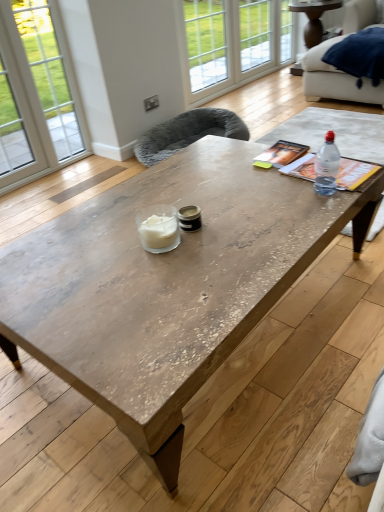
Locate an element on the screen. The height and width of the screenshot is (512, 384). free location in front of clear plastic bottle at upper right is located at coordinates (319, 209).